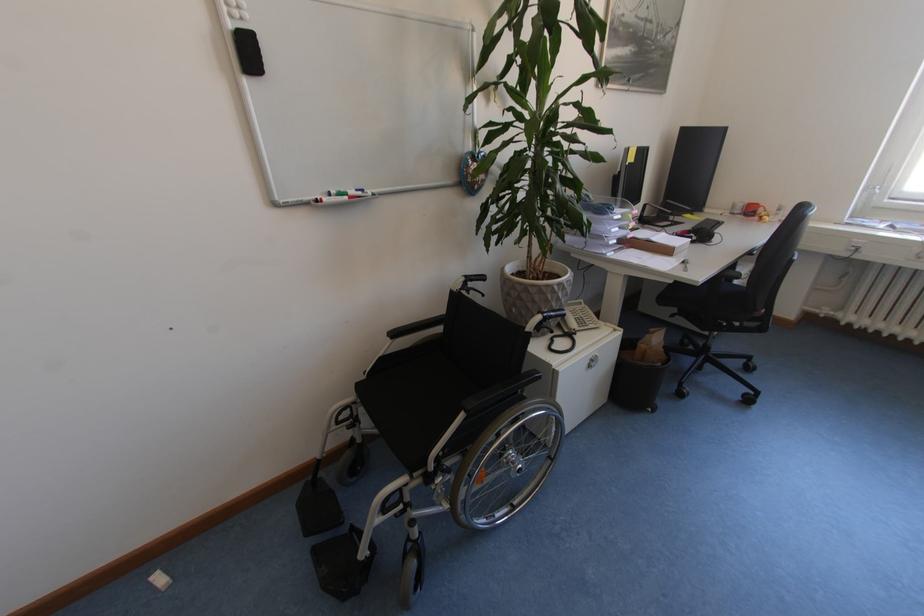
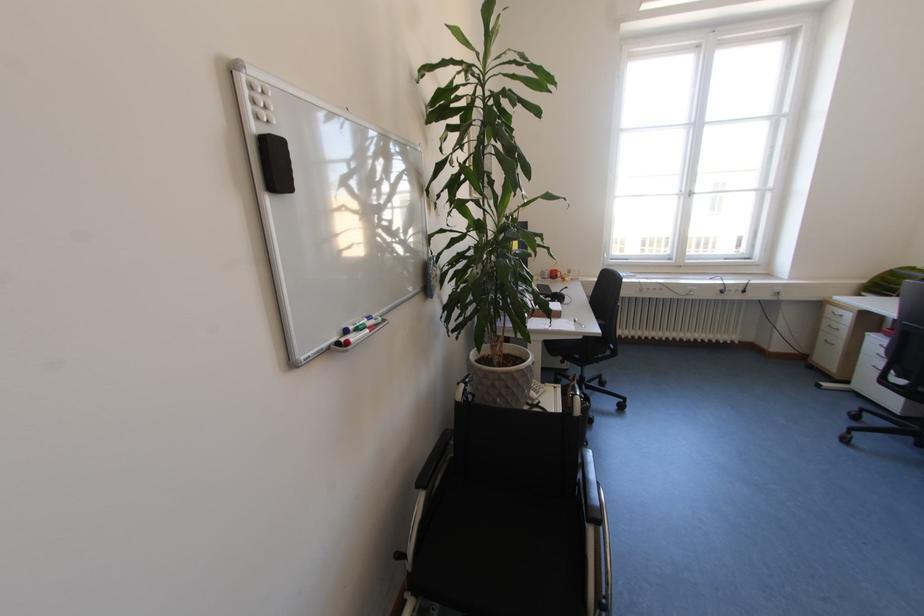
Question: Based on the continuous images, in which direction is the camera rotating? Reply with the corresponding letter.

Choices:
 (A) Left
 (B) Right
 (C) Up
 (D) Down

Answer: (B)